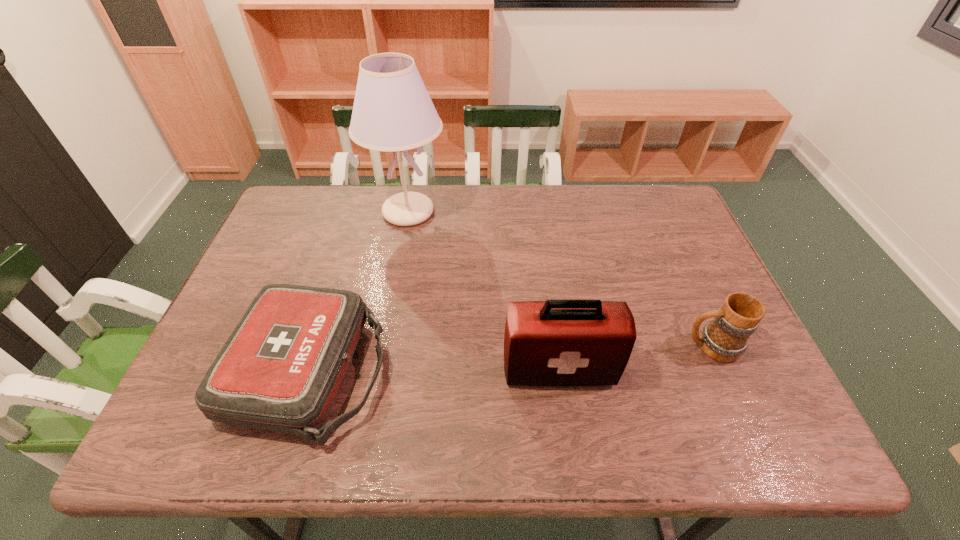
Locate an element on the screen. blank space located 0.260m on the side of the second shortest object with the handle is located at coordinates (571, 346).

Locate an element on the screen. The width and height of the screenshot is (960, 540). blank area located on the side of the second shortest object with the handle is located at coordinates (622, 346).

At what (x,y) coordinates should I click in order to perform the action: click on free region located on the side of the second shortest object with the handle. Please return your answer as a coordinate pair (x, y). The height and width of the screenshot is (540, 960). Looking at the image, I should click on (571, 346).

Locate an element on the screen. This screenshot has width=960, height=540. free space located on the back of the left first-aid kit is located at coordinates (355, 226).

The height and width of the screenshot is (540, 960). I want to click on object present at the far edge, so click(x=392, y=112).

Where is `object that is at the near edge`? Image resolution: width=960 pixels, height=540 pixels. object that is at the near edge is located at coordinates (280, 370).

The height and width of the screenshot is (540, 960). I want to click on object positioned at the left edge, so click(x=280, y=370).

Where is `object that is at the right edge`? object that is at the right edge is located at coordinates (725, 338).

Locate an element on the screen. This screenshot has width=960, height=540. object positioned at the near left corner is located at coordinates (280, 370).

The image size is (960, 540). In the image, there is a desktop. Identify the location of free space at the far edge. (603, 218).